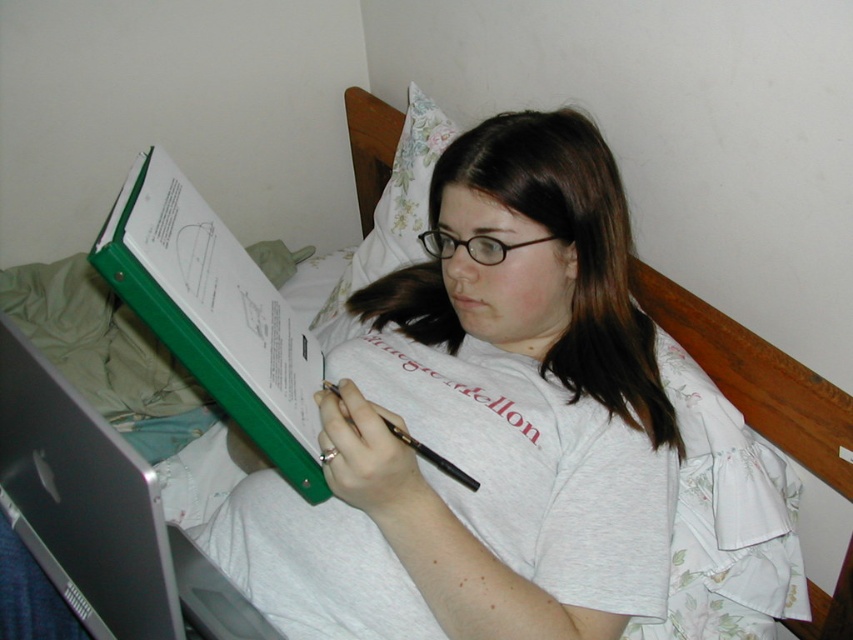
You are a photographer trying to capture a closeup of the black plastic glasses at center and the black plastic pen at center. Which object should you focus on first if you want to ensure both are in focus without adjusting the camera settings?

The black plastic glasses at center is not as tall as the black plastic pen at center, so focusing on the taller object, the black plastic pen at center, first would help ensure both are in focus.

From the picture: You are a student who wants to place a new notebook on the desk without blocking the laptop. The green plastic folder at upper left is represented by point (215, 314). Where should you place the notebook?

The green plastic folder at upper left is represented by point (215, 314). To avoid blocking the laptop, place the notebook to the right of the green plastic folder at upper left since the folder is at upper left and the laptop is on the left side of the frame.

You are a photographer trying to capture a closeup of the black plastic glasses at center. The camera you are using has a focal point at coordinate point (471, 244). Will the glasses be in focus?

The black plastic glasses at center is located at point (471, 244), so yes, the glasses will be in focus because the camera focal point is exactly at that coordinate.